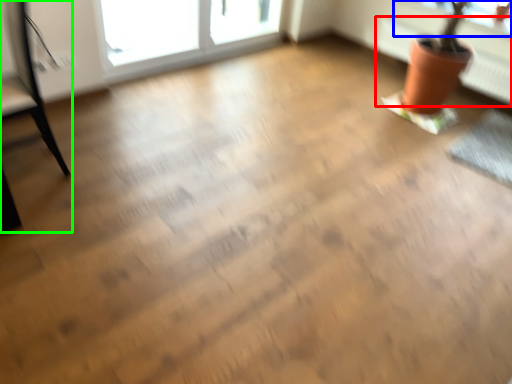
Question: Which object is the farthest from radiator (highlighted by a red box)? Choose among these: window screen (highlighted by a blue box) or armchair (highlighted by a green box).

Choices:
 (A) window screen
 (B) armchair

Answer: (B)